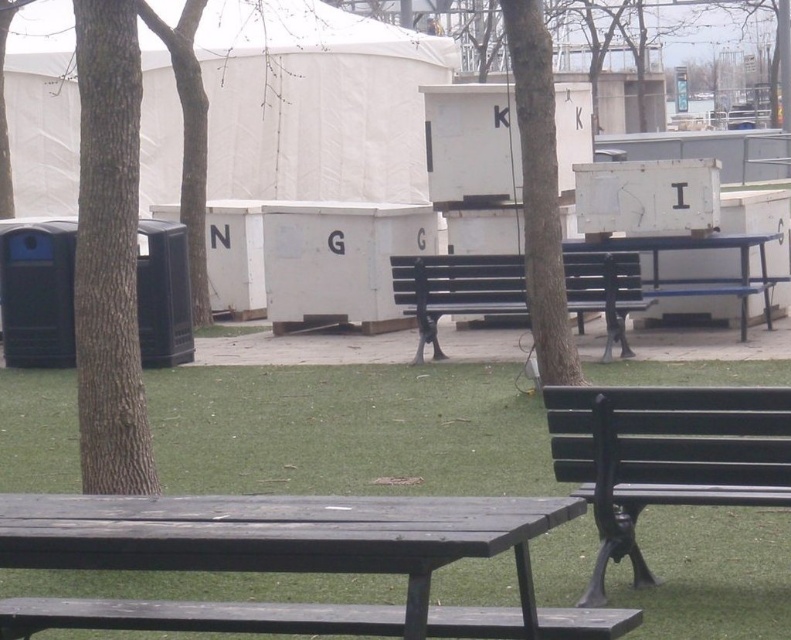
Who is higher up, weathered wood picnic table at center or blue painted metal park bench at center?

blue painted metal park bench at center is higher up.

Between point (209, 509) and point (742, 326), which one is positioned in front?

Point (209, 509) is in front.

Identify the location of weathered wood picnic table at center. (282, 536).

Between brown textured tree at center and matte black bench at center, which one is positioned higher?

Positioned higher is matte black bench at center.

Does point (555, 372) come closer to viewer compared to point (578, 321)?

Yes, it is in front of point (578, 321).

The image size is (791, 640). Describe the element at coordinates (540, 192) in the screenshot. I see `brown textured tree at center` at that location.

Locate an element on the screen. This screenshot has width=791, height=640. brown textured tree at center is located at coordinates (540, 192).

Which of these two, white fabric tent at center or green grass at center, stands shorter?

Standing shorter between the two is green grass at center.

At what (x,y) coordinates should I click in order to perform the action: click on white fabric tent at center. Please return your answer as a coordinate pair (x, y). Looking at the image, I should click on (315, 100).